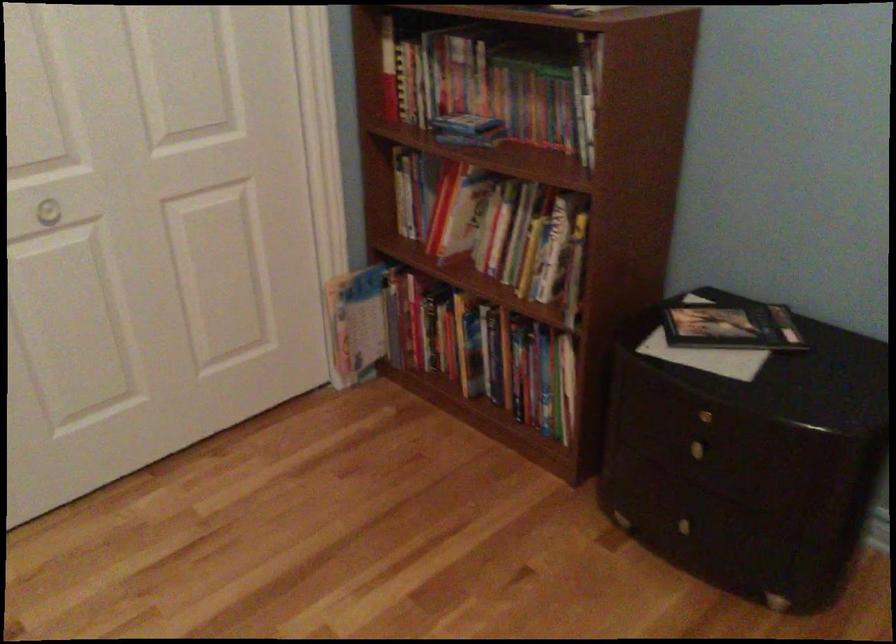
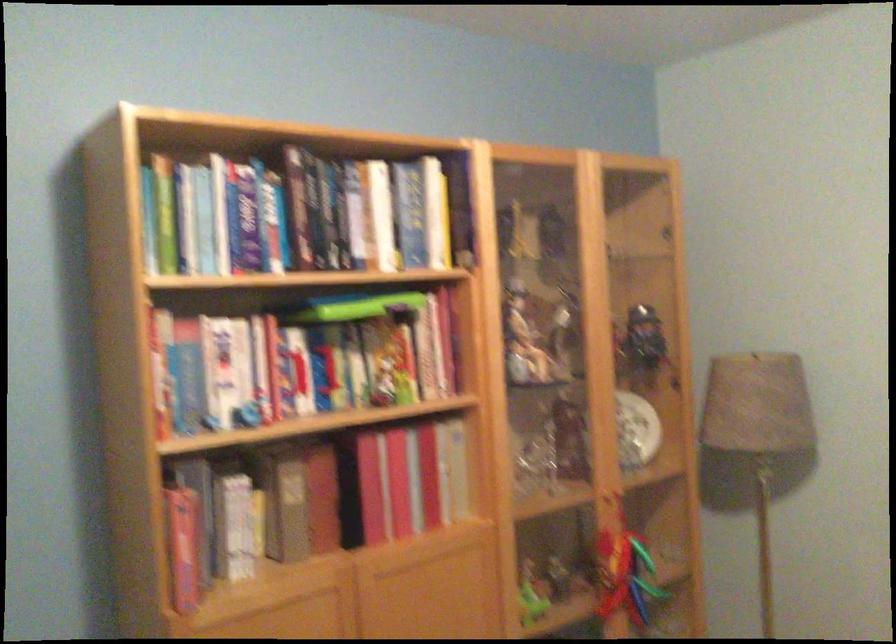
Question: Based on the continuous images, in which direction is the camera rotating? Reply with the corresponding letter.

Choices:
 (A) Left
 (B) Right
 (C) Up
 (D) Down

Answer: (B)